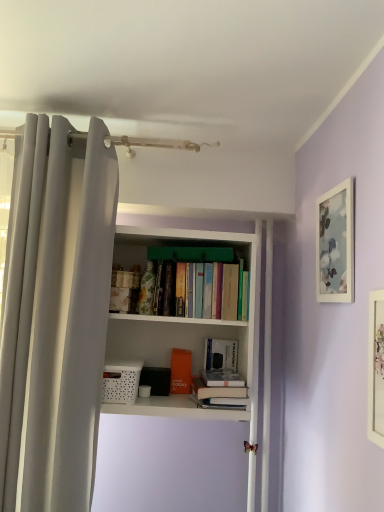
Question: Can you confirm if white matte book at center, acting as the 2th book starting from the top, is thinner than white fabric curtain at left?

Choices:
 (A) no
 (B) yes

Answer: (B)

Question: Is white matte book at center, acting as the 2th book starting from the top, positioned behind white fabric curtain at left?

Choices:
 (A) yes
 (B) no

Answer: (A)

Question: Does white matte book at center, which ranks as the 3th book in bottom-to-top order, touch white fabric curtain at left?

Choices:
 (A) no
 (B) yes

Answer: (A)

Question: Considering the relative sizes of white matte book at center, which ranks as the 3th book in bottom-to-top order, and white fabric curtain at left in the image provided, is white matte book at center, which ranks as the 3th book in bottom-to-top order, taller than white fabric curtain at left?

Choices:
 (A) no
 (B) yes

Answer: (A)

Question: Is white matte book at center, acting as the 2th book starting from the top, facing away from white fabric curtain at left?

Choices:
 (A) yes
 (B) no

Answer: (B)

Question: Considering the relative positions of white matte picture frame at upper right, the second picture frame positioned from the front, and hardcover books at center, which is the fourth book from bottom to top, in the image provided, is white matte picture frame at upper right, the second picture frame positioned from the front, to the left or to the right of hardcover books at center, which is the fourth book from bottom to top,?

Choices:
 (A) right
 (B) left

Answer: (A)

Question: Looking at the image, does white matte picture frame at upper right, acting as the first picture frame starting from the back, seem bigger or smaller compared to hardcover books at center, positioned as the first book in top-to-bottom order?

Choices:
 (A) small
 (B) big

Answer: (A)

Question: Is white matte picture frame at upper right, acting as the first picture frame starting from the back, taller or shorter than hardcover books at center, positioned as the first book in top-to-bottom order?

Choices:
 (A) tall
 (B) short

Answer: (A)

Question: From the image's perspective, is white matte picture frame at upper right, acting as the first picture frame starting from the back, above or below hardcover books at center, positioned as the first book in top-to-bottom order?

Choices:
 (A) below
 (B) above

Answer: (B)

Question: Relative to white matte book at center, which ranks as the 3th book in bottom-to-top order, is orange matte book at center, which is counted as the third book, starting from the top, in front or behind?

Choices:
 (A) behind
 (B) front

Answer: (A)

Question: From a real-world perspective, is orange matte book at center, placed as the second book when sorted from bottom to top, positioned above or below white matte book at center, which ranks as the 3th book in bottom-to-top order?

Choices:
 (A) above
 (B) below

Answer: (B)

Question: In the image, is orange matte book at center, which is counted as the third book, starting from the top, on the left side or the right side of white matte book at center, acting as the 2th book starting from the top?

Choices:
 (A) left
 (B) right

Answer: (A)

Question: Is orange matte book at center, which is counted as the third book, starting from the top, inside or outside of white matte book at center, which ranks as the 3th book in bottom-to-top order?

Choices:
 (A) inside
 (B) outside

Answer: (B)

Question: In the image, is white fabric curtain at left on the left side or the right side of hardcover books at center, which is the fourth book from bottom to top?

Choices:
 (A) right
 (B) left

Answer: (B)

Question: Is white fabric curtain at left in front of or behind hardcover books at center, positioned as the first book in top-to-bottom order, in the image?

Choices:
 (A) front
 (B) behind

Answer: (A)